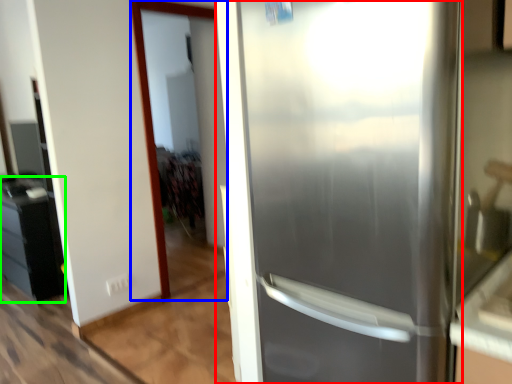
Question: Which object is positioned closest to refrigerator (highlighted by a red box)? Select from screen door (highlighted by a blue box) and cabinetry (highlighted by a green box).

Choices:
 (A) screen door
 (B) cabinetry

Answer: (A)